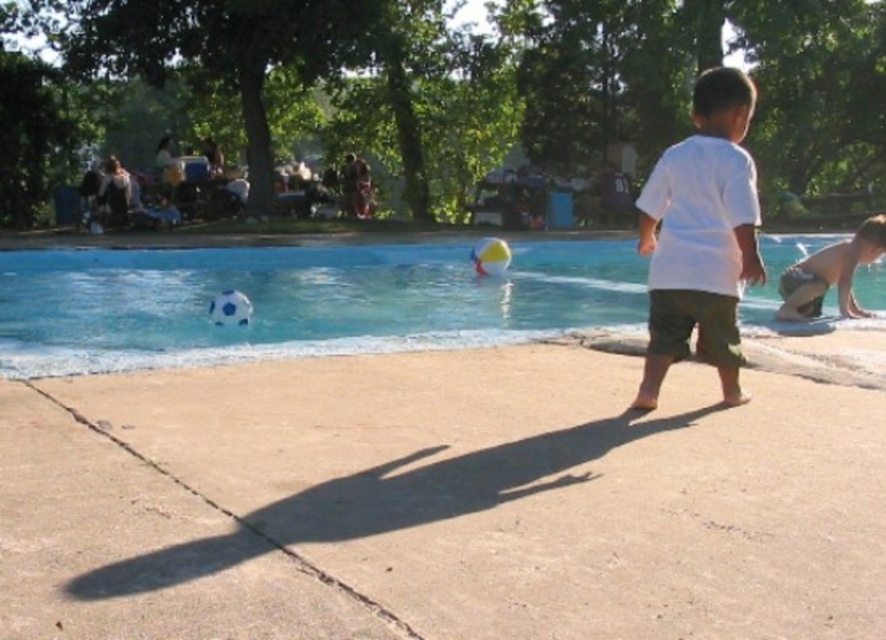
Does point (872, 301) come in front of point (840, 260)?

No, it is not.

Is point (478, 340) positioned in front of point (843, 262)?

That is True.

At what (x,y) coordinates should I click in order to perform the action: click on blue rubber ball at lower center. Please return your answer as a coordinate pair (x, y). The height and width of the screenshot is (640, 886). Looking at the image, I should click on (300, 300).

Which is above, blue rubber ball at lower center or white cotton shirt at center?

white cotton shirt at center is higher up.

Is point (284, 333) positioned after point (731, 394)?

Yes, point (284, 333) is behind point (731, 394).

The image size is (886, 640). I want to click on blue rubber ball at lower center, so click(x=300, y=300).

Can you confirm if white cotton shirt at center is taller than tan skin boy at right?

Correct, white cotton shirt at center is much taller as tan skin boy at right.

Is the position of white cotton shirt at center less distant than that of tan skin boy at right?

Yes, white cotton shirt at center is closer to the viewer.

Is point (719, 109) closer to viewer compared to point (842, 314)?

Yes.

This screenshot has width=886, height=640. I want to click on white cotton shirt at center, so click(701, 236).